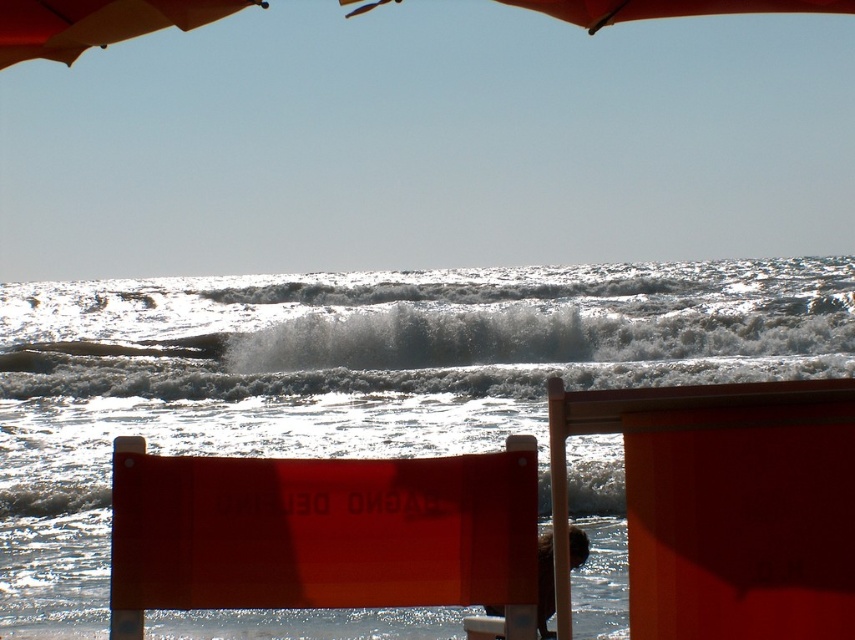
Question: Which of these objects is positioned farthest from the matte orange umbrella at upper left?

Choices:
 (A) white frothy wave at center
 (B) white frothy water at center

Answer: (A)

Question: Can you confirm if white frothy water at center is thinner than transparent plastic sign at center?

Choices:
 (A) no
 (B) yes

Answer: (A)

Question: Can you confirm if orange fabric umbrella at upper center is thinner than matte orange umbrella at upper left?

Choices:
 (A) yes
 (B) no

Answer: (B)

Question: Which of these objects is positioned closest to the white frothy wave at center?

Choices:
 (A) transparent plastic sign at center
 (B) white frothy water at center

Answer: (B)

Question: Which of the following is the farthest from the observer?

Choices:
 (A) (217, 477)
 (B) (604, 8)

Answer: (B)

Question: Can you confirm if white frothy water at center is wider than matte orange chair at lower right?

Choices:
 (A) yes
 (B) no

Answer: (A)